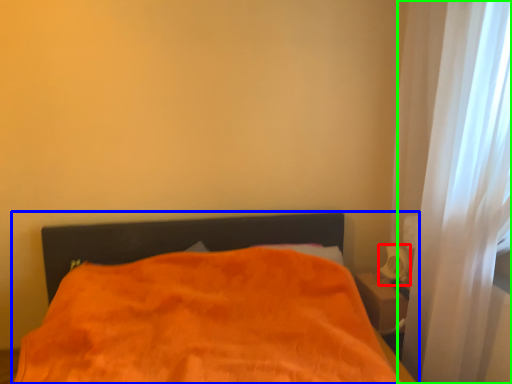
Question: Based on their relative distances, which object is nearer to table lamp (highlighted by a red box)? Choose from bed (highlighted by a blue box) and curtain (highlighted by a green box).

Choices:
 (A) bed
 (B) curtain

Answer: (B)